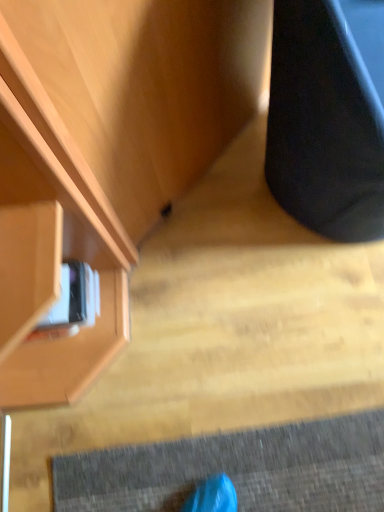
Image resolution: width=384 pixels, height=512 pixels. What are the coordinates of `free space above matte wood cabinet at upper left (from a real-world perspective)` in the screenshot? It's located at (204, 325).